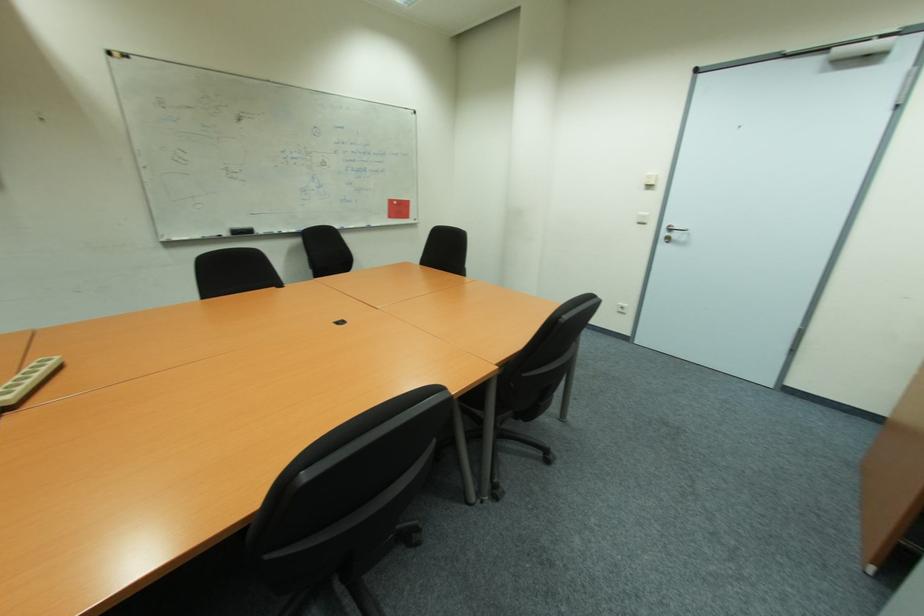
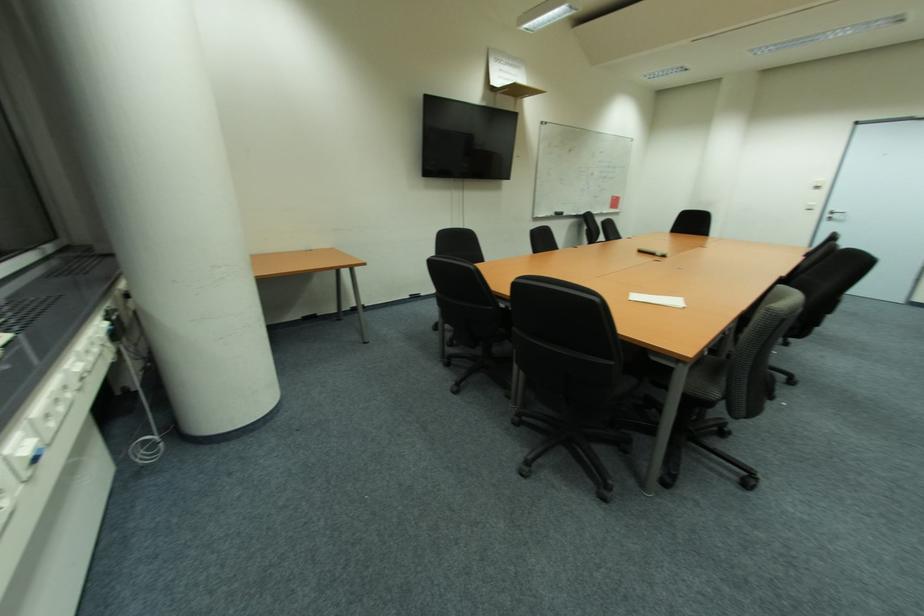
Question: I am providing you with two images of the same scene from different viewpoints. Which of the following objects are not visible in image2?

Choices:
 (A) silver door handle
 (B) white paper sheet
 (C) black chair sitting surface
 (D) none of these

Answer: (D)